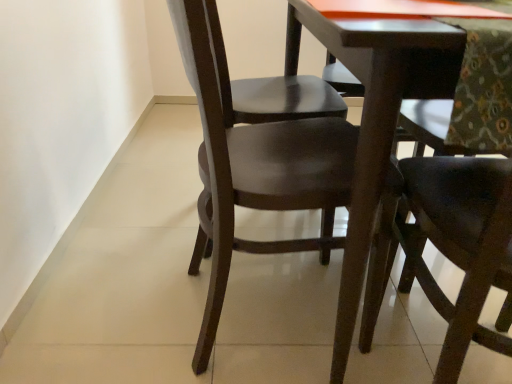
Question: Would you say dark wood chair at center, positioned as the first chair in right-to-left order, is inside or outside glossy dark wood chair at center, marked as the 2th chair in a right-to-left arrangement?

Choices:
 (A) outside
 (B) inside

Answer: (A)

Question: From the image's perspective, relative to glossy dark wood chair at center, the 1th chair when ordered from left to right, is dark wood chair at center, positioned as the first chair in right-to-left order, above or below?

Choices:
 (A) above
 (B) below

Answer: (B)

Question: From a real-world perspective, is dark wood chair at center, positioned as the first chair in right-to-left order, above or below glossy dark wood chair at center, marked as the 2th chair in a right-to-left arrangement?

Choices:
 (A) below
 (B) above

Answer: (A)

Question: Is glossy dark wood chair at center, the 1th chair when ordered from left to right, situated inside dark wood chair at center, which ranks as the 2th chair in left-to-right order, or outside?

Choices:
 (A) inside
 (B) outside

Answer: (B)

Question: From the image's perspective, is glossy dark wood chair at center, the 1th chair when ordered from left to right, above or below dark wood chair at center, positioned as the first chair in right-to-left order?

Choices:
 (A) below
 (B) above

Answer: (B)

Question: From a real-world perspective, is glossy dark wood chair at center, marked as the 2th chair in a right-to-left arrangement, above or below dark wood chair at center, positioned as the first chair in right-to-left order?

Choices:
 (A) below
 (B) above

Answer: (B)

Question: Considering the positions of glossy dark wood chair at center, the 1th chair when ordered from left to right, and dark wood chair at center, positioned as the first chair in right-to-left order, in the image, is glossy dark wood chair at center, the 1th chair when ordered from left to right, taller or shorter than dark wood chair at center, positioned as the first chair in right-to-left order,?

Choices:
 (A) short
 (B) tall

Answer: (A)